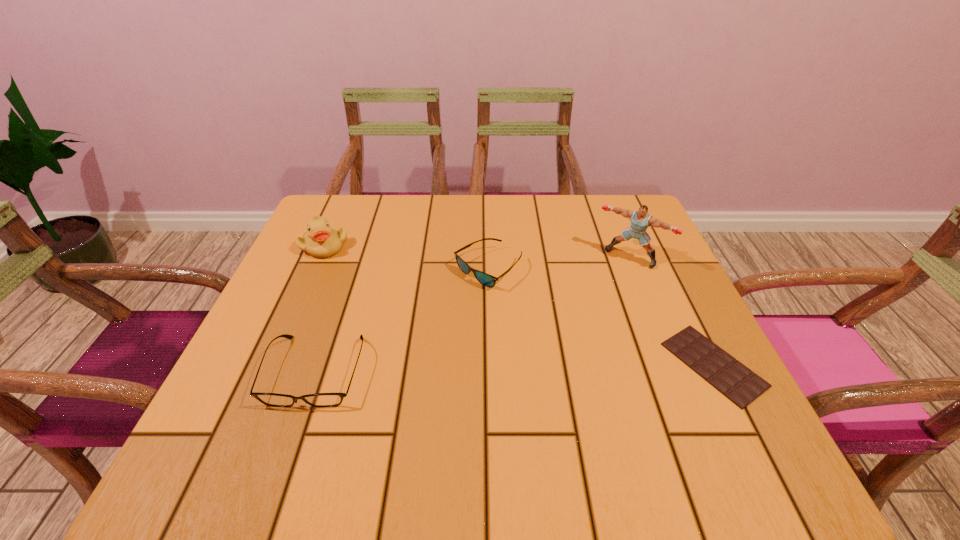
Find the location of a particular element. This screenshot has height=540, width=960. vacant point located between the fourth shortest object and the sunglasses is located at coordinates (406, 257).

Where is `empty space between the chocolate bar and the third object from left to right`? empty space between the chocolate bar and the third object from left to right is located at coordinates (601, 316).

At what (x,y) coordinates should I click in order to perform the action: click on empty space that is in between the sunglasses and the spectacles. Please return your answer as a coordinate pair (x, y). This screenshot has width=960, height=540. Looking at the image, I should click on pos(402,320).

Locate an element on the screen. The width and height of the screenshot is (960, 540). vacant space that is in between the spectacles and the shortest object is located at coordinates (515, 368).

Where is `object that can be found as the third closest to the puncher`? object that can be found as the third closest to the puncher is located at coordinates (270, 399).

Point out which object is positioned as the second nearest to the fourth shortest object. Please provide its 2D coordinates. Your answer should be formatted as a tuple, i.e. [(x, y)], where the tuple contains the x and y coordinates of a point satisfying the conditions above.

[(485, 279)]

What are the coordinates of `free point that satisfies the following two spatial constraints: 1. on the back side of the sunglasses; 2. on the left side of the puncher` in the screenshot? It's located at (488, 256).

At what (x,y) coordinates should I click in order to perform the action: click on vacant space that satisfies the following two spatial constraints: 1. on the front side of the duckling; 2. on the right side of the shortest object. Please return your answer as a coordinate pair (x, y). The width and height of the screenshot is (960, 540). Looking at the image, I should click on (273, 364).